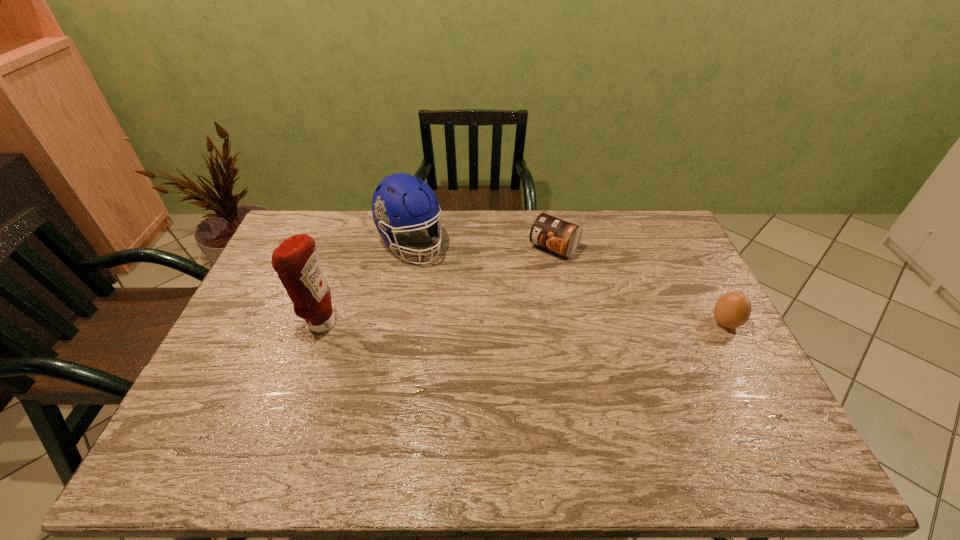
Where is `vacant area at the far left corner`? This screenshot has height=540, width=960. vacant area at the far left corner is located at coordinates (320, 212).

In the image, there is a desktop. In order to click on free region at the far right corner in this screenshot , I will do `click(627, 215)`.

The width and height of the screenshot is (960, 540). Identify the location of unoccupied position between the rightmost object and the condiment. 522,323.

The image size is (960, 540). I want to click on vacant space that's between the leftmost object and the third object from left to right, so click(437, 285).

Identify the location of free space between the third object from left to right and the boiled egg. pyautogui.click(x=639, y=285).

I want to click on free point between the rightmost object and the leftmost object, so click(x=522, y=323).

Identify the location of vacant space that's between the can and the rightmost object. (639, 285).

Locate an element on the screen. The width and height of the screenshot is (960, 540). vacant area that lies between the football helmet and the rightmost object is located at coordinates (568, 284).

Locate an element on the screen. empty location between the second object from left to right and the rightmost object is located at coordinates [x=568, y=284].

Locate an element on the screen. This screenshot has width=960, height=540. blank region between the can and the second tallest object is located at coordinates (482, 246).